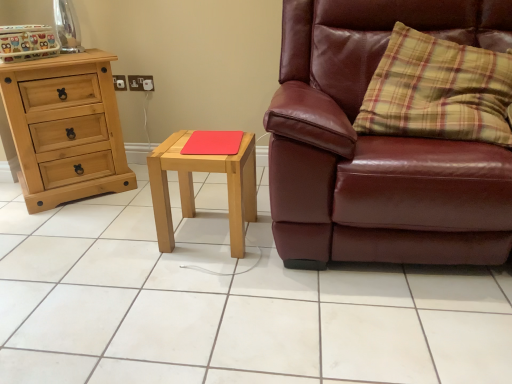
I want to click on yellow plaid pillow at right, so click(438, 91).

In order to click on leather couch at right in this screenshot , I will do `click(379, 145)`.

I want to click on light wood/matte nightstand at center, so click(193, 189).

Describe the element at coordinates (193, 189) in the screenshot. I see `light wood/matte nightstand at center` at that location.

Find the location of a particular element. white glossy tile at center is located at coordinates (227, 303).

From the image's perspective, relative to leather couch at right, is light wood/matte nightstand at center above or below?

Based on their image positions, light wood/matte nightstand at center is located beneath leather couch at right.

Which object is wider, light wood/matte nightstand at center or leather couch at right?

leather couch at right is wider.

Is leather couch at right surrounded by light wood/matte nightstand at center?

Actually, leather couch at right is outside light wood/matte nightstand at center.

Between light wood/matte nightstand at center and leather couch at right, which one appears on the left side from the viewer's perspective?

Positioned to the left is light wood/matte nightstand at center.

Does natural wood chest of drawers at left have a greater width compared to white glossy tile at center?

In fact, natural wood chest of drawers at left might be narrower than white glossy tile at center.

Who is taller, natural wood chest of drawers at left or white glossy tile at center?

natural wood chest of drawers at left.

From a real-world perspective, is natural wood chest of drawers at left positioned over white glossy tile at center based on gravity?

Yes, from a real-world perspective, natural wood chest of drawers at left is on top of white glossy tile at center.

Which object is positioned more to the left, natural wood chest of drawers at left or white glossy tile at center?

Positioned to the left is natural wood chest of drawers at left.

From a real-world perspective, is red matte mousepad at center positioned under natural wood chest of drawers at left based on gravity?

No.

How many degrees apart are the facing directions of red matte mousepad at center and natural wood chest of drawers at left?

They differ by 36.8 degrees in their facing directions.

Considering the positions of objects red matte mousepad at center and natural wood chest of drawers at left in the image provided, who is behind, red matte mousepad at center or natural wood chest of drawers at left?

natural wood chest of drawers at left is behind.

From the image's perspective, is red matte mousepad at center located beneath natural wood chest of drawers at left?

Indeed, from the image's perspective, red matte mousepad at center is shown beneath natural wood chest of drawers at left.

Visually, is white glossy tile at center positioned to the left or to the right of light wood/matte nightstand at center?

From the image, it's evident that white glossy tile at center is to the left of light wood/matte nightstand at center.

In the image, is white glossy tile at center positioned in front of or behind light wood/matte nightstand at center?

Visually, white glossy tile at center is located in front of light wood/matte nightstand at center.

How far apart are white glossy tile at center and light wood/matte nightstand at center?

white glossy tile at center is 12.93 inches away from light wood/matte nightstand at center.

Is white glossy tile at center turned away from light wood/matte nightstand at center?

No, white glossy tile at center is not facing away from light wood/matte nightstand at center.

Is the surface of yellow plaid pillow at right in direct contact with white glossy tile at center?

No.

From the image's perspective, which one is positioned higher, yellow plaid pillow at right or white glossy tile at center?

yellow plaid pillow at right appears higher in the image.

Considering the relative sizes of yellow plaid pillow at right and white glossy tile at center in the image provided, is yellow plaid pillow at right thinner than white glossy tile at center?

Yes.

Does point (422, 131) appear closer or farther from the camera than point (424, 352)?

Point (422, 131) appears to be farther away from the viewer than point (424, 352).

Is red matte mousepad at center positioned far away from leather couch at right?

red matte mousepad at center is actually quite close to leather couch at right.

Consider the image. From the image's perspective, between red matte mousepad at center and leather couch at right, which one is located above?

leather couch at right appears higher in the image.

From a real-world perspective, does red matte mousepad at center stand above leather couch at right?

Actually, red matte mousepad at center is physically below leather couch at right in the real world.

How distant is red matte mousepad at center from leather couch at right?

A distance of 18.07 inches exists between red matte mousepad at center and leather couch at right.

Considering the relative sizes of leather couch at right and light wood/matte nightstand at center in the image provided, is leather couch at right wider than light wood/matte nightstand at center?

Indeed, leather couch at right has a greater width compared to light wood/matte nightstand at center.

Can you confirm if leather couch at right is positioned to the left of light wood/matte nightstand at center?

In fact, leather couch at right is to the right of light wood/matte nightstand at center.

From the picture: How different are the orientations of leather couch at right and light wood/matte nightstand at center in degrees?

The angle between the facing direction of leather couch at right and the facing direction of light wood/matte nightstand at center is 3.87 degrees.

Does leather couch at right come behind light wood/matte nightstand at center?

No, leather couch at right is closer to the camera.

The height and width of the screenshot is (384, 512). Identify the location of chair on the right of light wood/matte nightstand at center. pyautogui.click(x=379, y=145).

In the image, there is a white glossy tile at center. Identify the location of the chest of drawers above it (from the image's perspective). (65, 128).

Looking at the image, which one is located closer to white glossy tile at center, yellow plaid pillow at right or natural wood chest of drawers at left?

natural wood chest of drawers at left.

Estimate the real-world distances between objects in this image. Which object is closer to red matte mousepad at center, natural wood chest of drawers at left or leather couch at right?

The object closer to red matte mousepad at center is leather couch at right.

When comparing their distances from natural wood chest of drawers at left, does yellow plaid pillow at right or white glossy tile at center seem further?

Among the two, yellow plaid pillow at right is located further to natural wood chest of drawers at left.

Which object lies nearer to the anchor point white glossy tile at center, red matte mousepad at center or yellow plaid pillow at right?

Based on the image, red matte mousepad at center appears to be nearer to white glossy tile at center.

Considering their positions, is natural wood chest of drawers at left positioned closer to red matte mousepad at center than white glossy tile at center?

white glossy tile at center is closer to red matte mousepad at center.

In the scene shown: Based on their spatial positions, is white glossy tile at center or natural wood chest of drawers at left closer to red matte mousepad at center?

Based on the image, white glossy tile at center appears to be nearer to red matte mousepad at center.

Considering their positions, is red matte mousepad at center positioned closer to natural wood chest of drawers at left than white glossy tile at center?

white glossy tile at center is closer to natural wood chest of drawers at left.

Which object lies further to the anchor point yellow plaid pillow at right, light wood/matte nightstand at center or natural wood chest of drawers at left?

natural wood chest of drawers at left is positioned further to the anchor yellow plaid pillow at right.

You are a GUI agent. You are given a task and a screenshot of the screen. Output one action in this format:
    pyautogui.click(x=<x>, y=<y>)
    Task: Click on the nightstand located between white glossy tile at center and red matte mousepad at center in the depth direction
    
    Given the screenshot: What is the action you would take?
    pyautogui.click(x=193, y=189)

The height and width of the screenshot is (384, 512). Identify the location of nightstand located between white glossy tile at center and leather couch at right in the left-right direction. (193, 189).

I want to click on chair between white glossy tile at center and yellow plaid pillow at right in the horizontal direction, so click(x=379, y=145).

You are a GUI agent. You are given a task and a screenshot of the screen. Output one action in this format:
    pyautogui.click(x=<x>, y=<y>)
    Task: Click on the ceramic tile between natural wood chest of drawers at left and leather couch at right in the horizontal direction
    
    Given the screenshot: What is the action you would take?
    pyautogui.click(x=227, y=303)